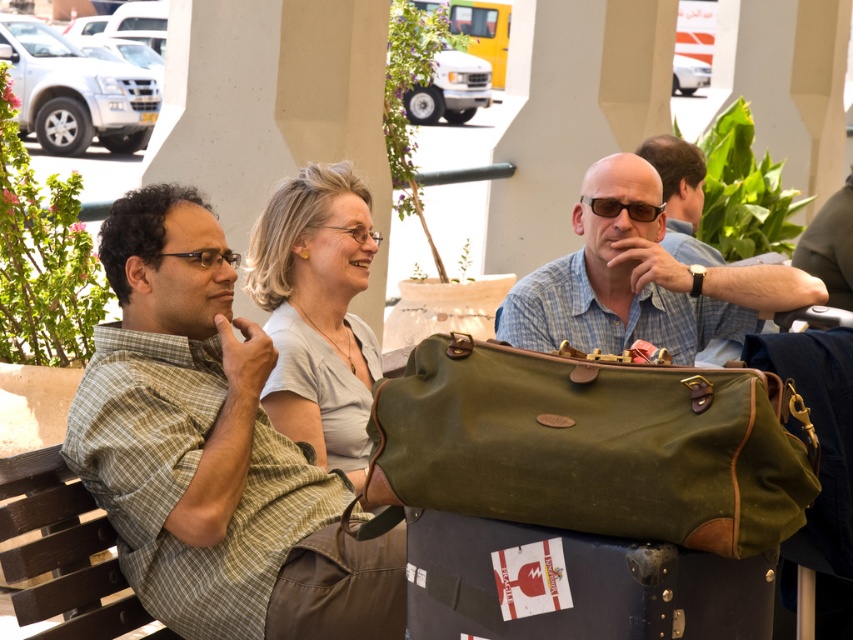
You are a person trying to sit down on the brown wooden park bench at lower left. Is there enough space for you to sit there since there is a matte green leather suitcase at center?

The matte green leather suitcase at center is in front of the brown wooden park bench at lower left, so it might block your access to the bench. Move the suitcase or choose another spot to sit.

You are a delivery person standing at the location of the white smooth pillar at center. You need to deliver a package to the group of three individuals seated under the covered area. Can you walk directly to them without needing to detour around any obstacles?

The distance between the white smooth pillar at center and the group is 6.42 meters. Since there are no obstacles mentioned in the scene description, you can walk directly to them.

You are a delivery person who needs to place a package between the white smooth pillar at center and the matte gray shirt at center. The package requires a space of 2 meters. Is there enough space?

The white smooth pillar at center is 2.33 meters away from the matte gray shirt at center, so yes, there is enough space to place the package between them since the distance is greater than 2 meters.